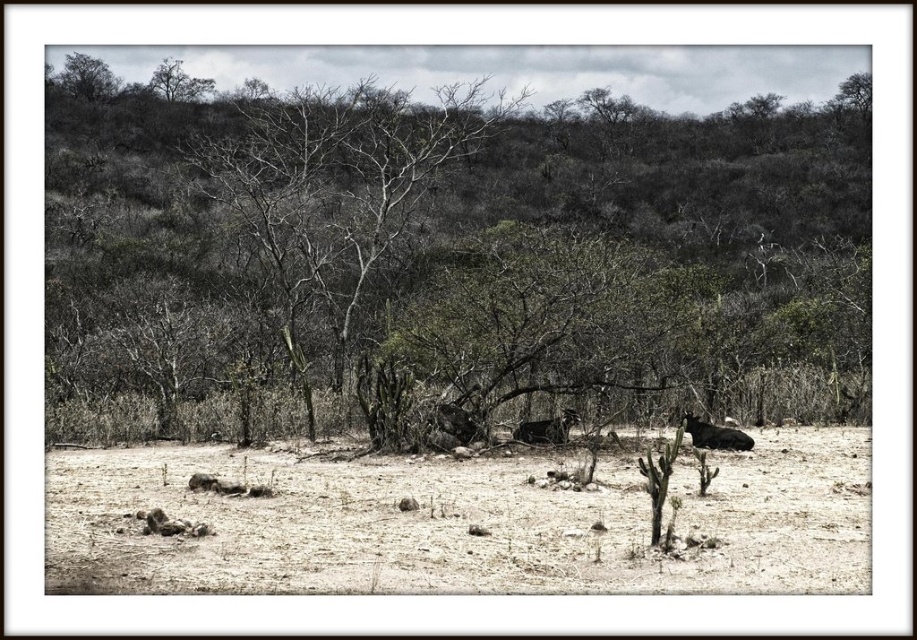
Which of these two, brown dirt ground at center or dark brown fur at lower right, stands shorter?

With less height is dark brown fur at lower right.

Where is `brown dirt ground at center`? Image resolution: width=917 pixels, height=640 pixels. brown dirt ground at center is located at coordinates (463, 522).

Can you confirm if dark green leafy tree at upper left is positioned above dark brown fur at center?

Correct, dark green leafy tree at upper left is located above dark brown fur at center.

Between point (78, 90) and point (564, 436), which one is positioned behind?

The point (78, 90) is more distant.

Find the location of a particular element. The image size is (917, 640). dark green leafy tree at upper left is located at coordinates (86, 77).

Looking at this image, is green leafy tree at center above dark brown fur at lower right?

Correct, green leafy tree at center is located above dark brown fur at lower right.

Is the position of green leafy tree at center less distant than that of dark brown fur at lower right?

No, it is not.

Is point (578, 392) less distant than point (687, 413)?

That is True.

The width and height of the screenshot is (917, 640). Identify the location of green leafy tree at center. (447, 259).